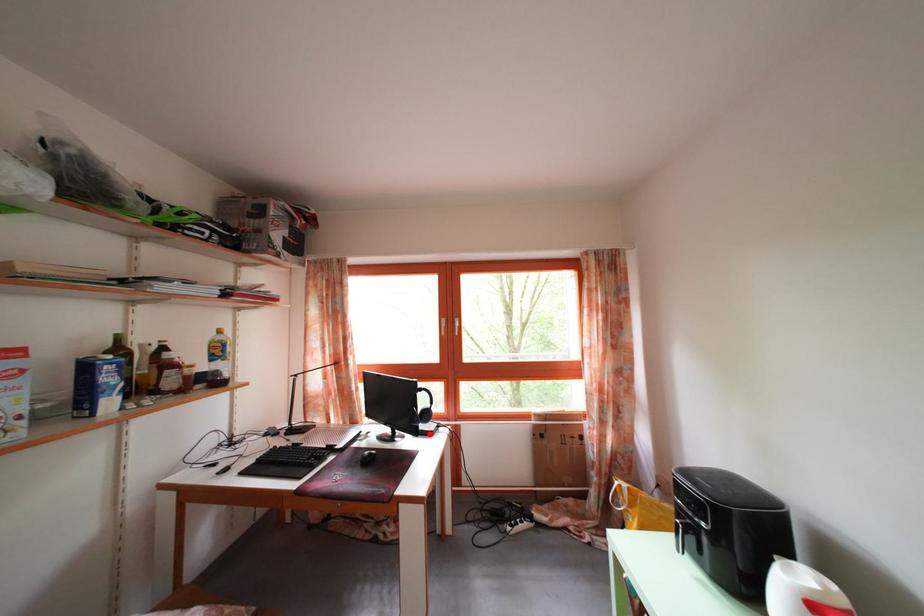
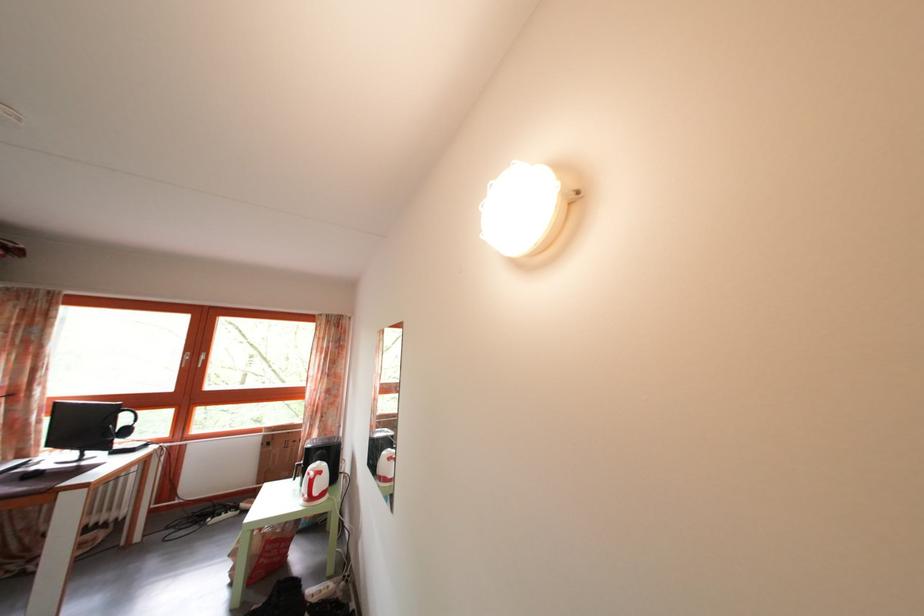
Question: A red point is marked in image1. In image2, is the corresponding 3D point closer to the camera or farther? Reply with the corresponding letter.

Choices:
 (A) The corresponding 3D point is closer.
 (B) The corresponding 3D point is farther.

Answer: (A)